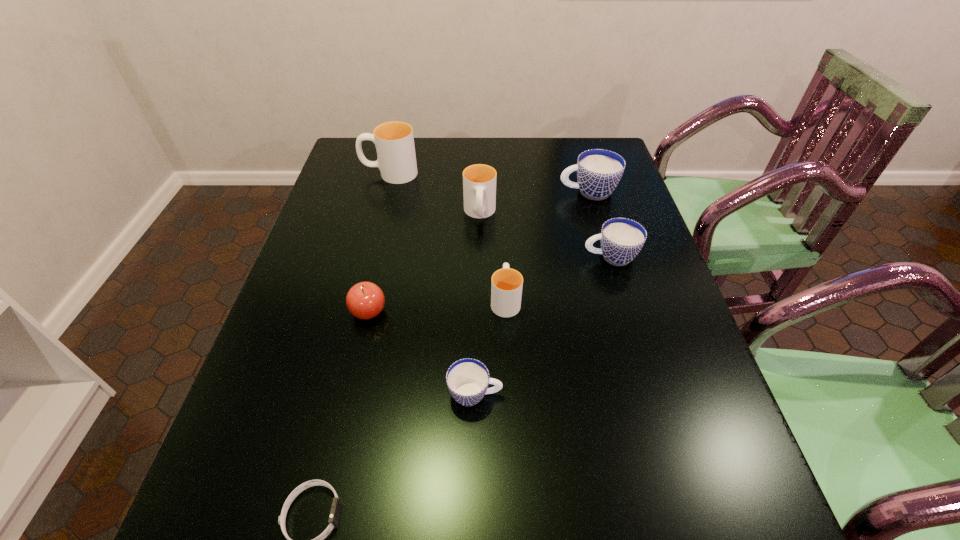
Find the location of a particular element. This screenshot has width=960, height=540. free space at the left edge is located at coordinates click(x=354, y=210).

Identify the location of free space at the right edge of the desktop. (685, 363).

Locate an element on the screen. The width and height of the screenshot is (960, 540). unoccupied area between the nearest blue cup and the tallest cup is located at coordinates (432, 284).

I want to click on vacant space that's between the farthest blue cup and the apple, so click(478, 252).

Locate an element on the screen. Image resolution: width=960 pixels, height=540 pixels. free point between the fifth farthest cup and the apple is located at coordinates (437, 306).

Where is `free point between the leftmost yellow cup and the fifth farthest cup`? This screenshot has width=960, height=540. free point between the leftmost yellow cup and the fifth farthest cup is located at coordinates pyautogui.click(x=447, y=237).

At what (x,y) coordinates should I click in order to perform the action: click on free point between the second nearest blue cup and the second nearest cup. Please return your answer as a coordinate pair (x, y). This screenshot has width=960, height=540. Looking at the image, I should click on (558, 278).

Find the location of a particular element. This screenshot has width=960, height=540. free space between the biggest blue cup and the smallest yellow cup is located at coordinates (546, 246).

Locate an element on the screen. The height and width of the screenshot is (540, 960). free spot between the second smallest blue cup and the tallest object is located at coordinates (500, 215).

The width and height of the screenshot is (960, 540). What are the coordinates of `free space between the farthest yellow cup and the third nearest cup` in the screenshot? It's located at (500, 215).